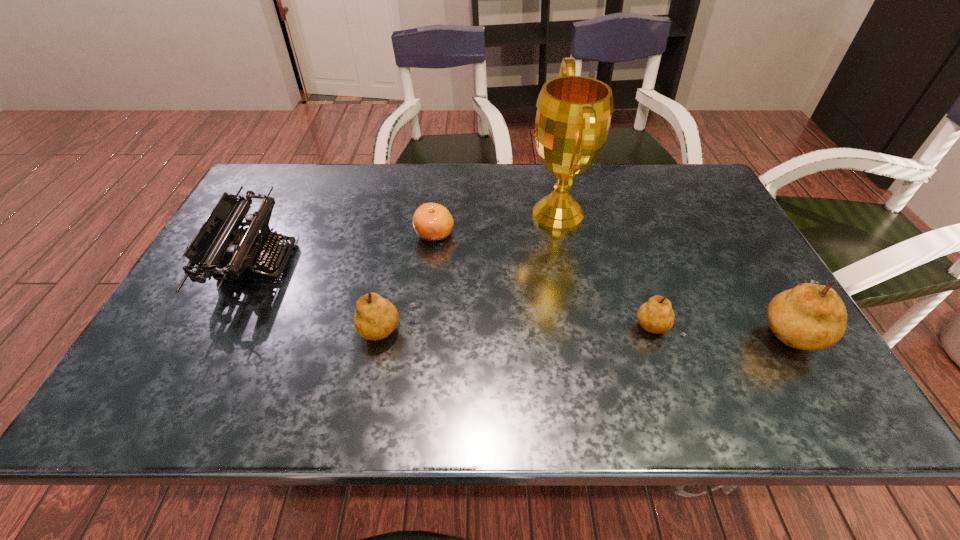
Identify the location of spot to insert another pear for uniform distribution. (521, 330).